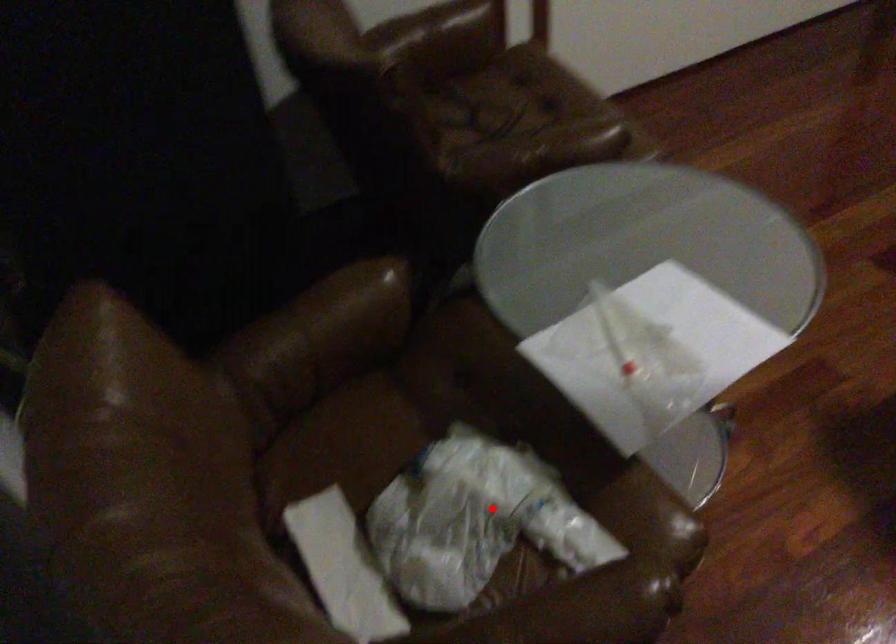
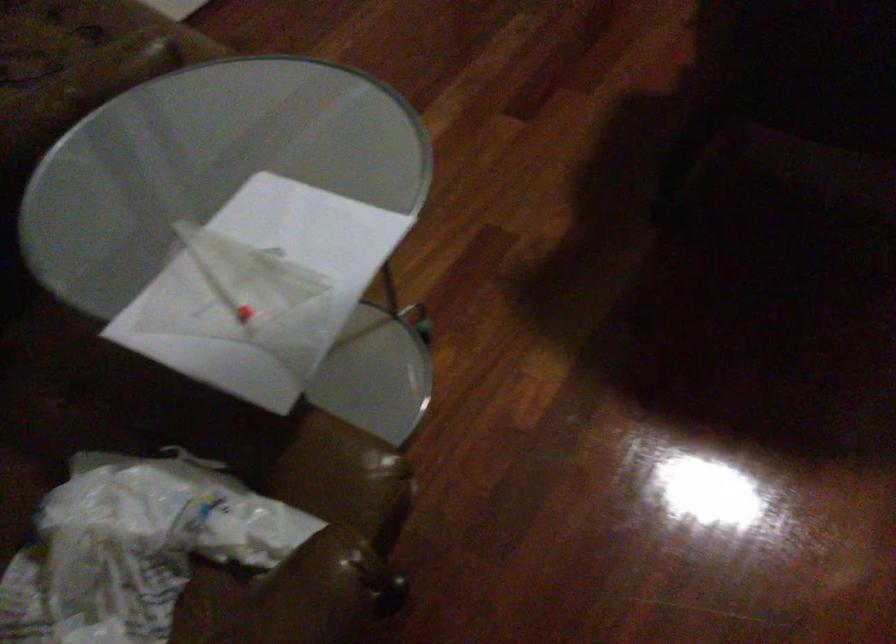
In the second image, find the point that corresponds to the highlighted location in the first image.

(134, 547)